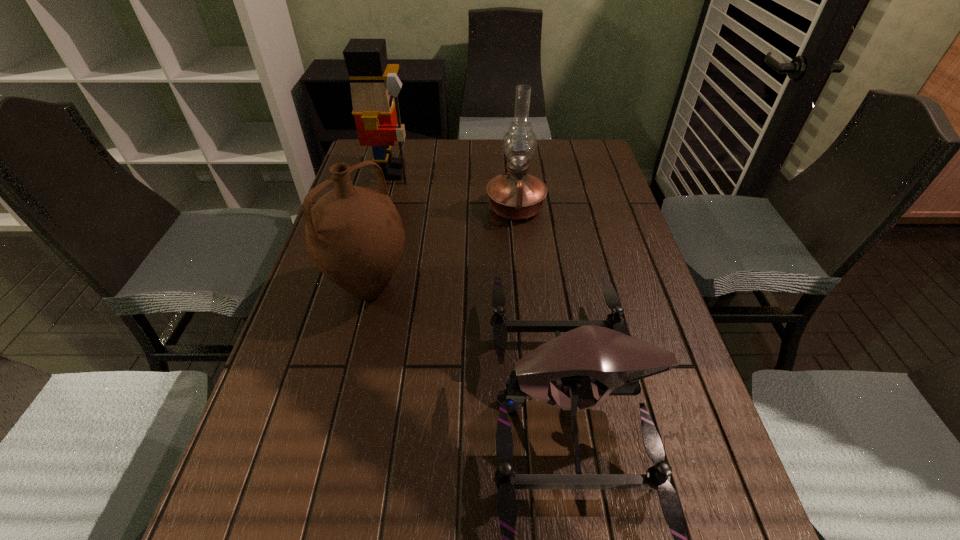
Locate an element on the screen. Image resolution: width=960 pixels, height=540 pixels. free spot that satisfies the following two spatial constraints: 1. on the back side of the oil lamp; 2. on the right side of the pitcher is located at coordinates [x=389, y=208].

Identify the location of vacant region that satisfies the following two spatial constraints: 1. in front of the pitcher holding the staff; 2. on the right side of the farthest object. (362, 288).

The image size is (960, 540). What are the coordinates of `free spot that satisfies the following two spatial constraints: 1. in front of the nutcracker holding the staff; 2. on the back side of the oil lamp` in the screenshot? It's located at (382, 208).

The width and height of the screenshot is (960, 540). In order to click on blank area in the image that satisfies the following two spatial constraints: 1. in front of the farthest object holding the staff; 2. on the left side of the pitcher in this screenshot , I will do `click(362, 288)`.

Where is `free spot that satisfies the following two spatial constraints: 1. in front of the pitcher holding the staff; 2. on the right side of the nutcracker`? The height and width of the screenshot is (540, 960). free spot that satisfies the following two spatial constraints: 1. in front of the pitcher holding the staff; 2. on the right side of the nutcracker is located at coordinates (362, 288).